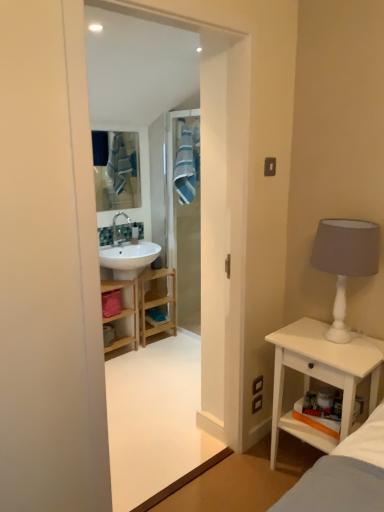
What do you see at coordinates (116, 170) in the screenshot? The height and width of the screenshot is (512, 384). I see `blue fabric mirror at upper center` at bounding box center [116, 170].

Image resolution: width=384 pixels, height=512 pixels. What do you see at coordinates (322, 375) in the screenshot?
I see `white wood nightstand at right` at bounding box center [322, 375].

What are the coordinates of `white matte table lamp at right` in the screenshot? It's located at (345, 261).

In order to click on blue fabric mirror at upper center in this screenshot , I will do `click(116, 170)`.

Is blue striped fabric at center positioned with its back to blue fabric mirror at upper center?

No, blue striped fabric at center is not facing the opposite direction of blue fabric mirror at upper center.

Considering the relative sizes of blue striped fabric at center and blue fabric mirror at upper center in the image provided, is blue striped fabric at center wider than blue fabric mirror at upper center?

Yes.

From the image's perspective, is blue striped fabric at center below blue fabric mirror at upper center?

No, from the image's perspective, blue striped fabric at center is not beneath blue fabric mirror at upper center.

Is blue striped fabric at center positioned before blue fabric mirror at upper center?

Yes, the depth of blue striped fabric at center is less than that of blue fabric mirror at upper center.

Considering the sizes of objects white wood nightstand at right and white matte table lamp at right in the image provided, who is taller, white wood nightstand at right or white matte table lamp at right?

white wood nightstand at right is taller.

Considering the positions of points (381, 345) and (336, 272), is point (381, 345) closer to camera compared to point (336, 272)?

No.

How different are the orientations of white wood nightstand at right and white matte table lamp at right in degrees?

white wood nightstand at right and white matte table lamp at right are facing 1.98 degrees away from each other.

Can you confirm if white wood nightstand at right is positioned to the right of white matte table lamp at right?

Incorrect, white wood nightstand at right is not on the right side of white matte table lamp at right.

Find the location of a particular element. bathroom cabinet on the left of white matte table lamp at right is located at coordinates (122, 313).

From the picture: How different are the orientations of white matte table lamp at right and wooden cabinet at center in degrees?

The angular difference between white matte table lamp at right and wooden cabinet at center is 87.7 degrees.

From the image's perspective, is white matte table lamp at right over wooden cabinet at center?

Correct, white matte table lamp at right appears higher than wooden cabinet at center in the image.

From the picture: Between white matte table lamp at right and wooden cabinet at center, which one has larger size?

With larger size is wooden cabinet at center.

From a real-world perspective, which is physically above, wooden cabinet at center or blue striped fabric at center?

blue striped fabric at center, from a real-world perspective.

Considering the sizes of objects wooden cabinet at center and blue striped fabric at center in the image provided, who is wider, wooden cabinet at center or blue striped fabric at center?

With larger width is wooden cabinet at center.

Based on their sizes in the image, would you say wooden cabinet at center is bigger or smaller than blue striped fabric at center?

In the image, wooden cabinet at center appears to be larger than blue striped fabric at center.

Between blue striped fabric at center and wooden cabinet at center, which one has smaller width?

Thinner between the two is blue striped fabric at center.

How far apart are blue striped fabric at center and wooden cabinet at center?

38.27 inches.

Consider the image. From the image's perspective, is blue striped fabric at center on top of wooden cabinet at center?

Yes, from the image's perspective, blue striped fabric at center is on top of wooden cabinet at center.

Does blue striped fabric at center turn towards wooden cabinet at center?

No, blue striped fabric at center is not oriented towards wooden cabinet at center.

From the image's perspective, which is below, white glossy sink at upper left or blue fabric mirror at upper center?

white glossy sink at upper left, from the image's perspective.

This screenshot has width=384, height=512. I want to click on toiletry that appears on the right of blue fabric mirror at upper center, so click(135, 233).

Is blue fabric mirror at upper center a part of white glossy sink at upper left?

Definitely not — blue fabric mirror at upper center is not inside white glossy sink at upper left.

From the image's perspective, is blue fabric mirror at upper center positioned above or below white wood nightstand at right?

Clearly, from the image's perspective, blue fabric mirror at upper center is above white wood nightstand at right.

Based on the photo, is blue fabric mirror at upper center positioned with its back to white wood nightstand at right?

No.

At what (x,y) coordinates should I click in order to perform the action: click on nightstand lying on the right of blue fabric mirror at upper center. Please return your answer as a coordinate pair (x, y). Looking at the image, I should click on (322, 375).

Which is behind, blue fabric mirror at upper center or white wood nightstand at right?

blue fabric mirror at upper center is behind.

Where is `bath towel in front of the blue fabric mirror at upper center`? This screenshot has height=512, width=384. bath towel in front of the blue fabric mirror at upper center is located at coordinates (187, 163).

Locate an element on the screen. This screenshot has height=512, width=384. table lamp above the white wood nightstand at right (from the image's perspective) is located at coordinates (345, 261).

Consider the image. Which object lies further to the anchor point blue striped fabric at center, blue fabric mirror at upper center or white wood nightstand at right?

white wood nightstand at right is further to blue striped fabric at center.

Which object lies nearer to the anchor point white glossy sink at upper left, white matte table lamp at right or blue fabric mirror at upper center?

blue fabric mirror at upper center is positioned closer to the anchor white glossy sink at upper left.

From the image, which object appears to be nearer to white wood nightstand at right, blue striped fabric at center or wooden cabinet at center?

Based on the image, wooden cabinet at center appears to be nearer to white wood nightstand at right.

Considering their positions, is blue fabric mirror at upper center positioned closer to blue striped fabric at center than wooden cabinet at center?

blue fabric mirror at upper center is positioned closer to the anchor blue striped fabric at center.

Considering their positions, is blue striped fabric at center positioned further to white matte table lamp at right than blue fabric mirror at upper center?

blue fabric mirror at upper center.

Which object lies further to the anchor point white glossy sink at upper left, white wood nightstand at right or wooden cabinet at center?

Based on the image, white wood nightstand at right appears to be further to white glossy sink at upper left.

Estimate the real-world distances between objects in this image. Which object is further from white wood nightstand at right, white matte table lamp at right or wooden cabinet at center?

Among the two, wooden cabinet at center is located further to white wood nightstand at right.

Looking at the image, which one is located closer to blue striped fabric at center, blue fabric mirror at upper center or white matte table lamp at right?

blue fabric mirror at upper center.

Where is `mirror positioned between white wood nightstand at right and white glossy sink at upper left from near to far`? mirror positioned between white wood nightstand at right and white glossy sink at upper left from near to far is located at coordinates (116, 170).

Identify the location of bathroom cabinet between white wood nightstand at right and white glossy sink at upper left from front to back. The height and width of the screenshot is (512, 384). (122, 313).

At what (x,y) coordinates should I click in order to perform the action: click on toiletry between blue fabric mirror at upper center and wooden cabinet at center in the vertical direction. Please return your answer as a coordinate pair (x, y). This screenshot has width=384, height=512. Looking at the image, I should click on (135, 233).

In order to click on bath towel positioned between white wood nightstand at right and white glossy sink at upper left from near to far in this screenshot , I will do 187,163.